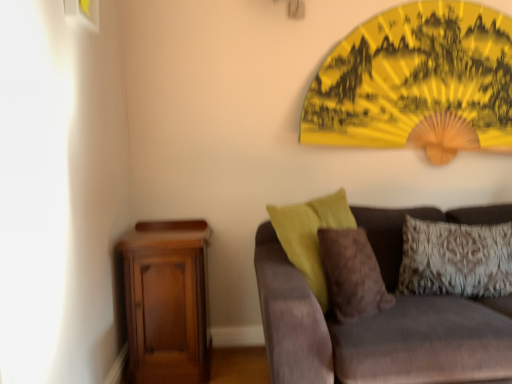
Question: Does brown fuzzy pillow at center, the 2th pillow viewed from the right, appear on the left side of patterned fabric pillow at right, positioned as the 2th pillow in left-to-right order?

Choices:
 (A) no
 (B) yes

Answer: (B)

Question: From a real-world perspective, is brown fuzzy pillow at center, the 2th pillow viewed from the right, over patterned fabric pillow at right, marked as the 1th pillow in a right-to-left arrangement?

Choices:
 (A) yes
 (B) no

Answer: (A)

Question: Is brown fuzzy pillow at center, the 2th pillow viewed from the right, smaller than patterned fabric pillow at right, marked as the 1th pillow in a right-to-left arrangement?

Choices:
 (A) no
 (B) yes

Answer: (B)

Question: Is brown fuzzy pillow at center, which appears as the 1th pillow when viewed from the left, shorter than patterned fabric pillow at right, positioned as the 2th pillow in left-to-right order?

Choices:
 (A) yes
 (B) no

Answer: (B)

Question: Is the position of brown fuzzy pillow at center, which appears as the 1th pillow when viewed from the left, more distant than that of patterned fabric pillow at right, marked as the 1th pillow in a right-to-left arrangement?

Choices:
 (A) yes
 (B) no

Answer: (B)

Question: From the image's perspective, is brown fuzzy pillow at center, the 2th pillow viewed from the right, located above patterned fabric pillow at right, marked as the 1th pillow in a right-to-left arrangement?

Choices:
 (A) yes
 (B) no

Answer: (B)

Question: Can you confirm if velvet brown couch at lower right is bigger than matte white picture frame at upper left?

Choices:
 (A) yes
 (B) no

Answer: (A)

Question: Is velvet brown couch at lower right to the left of matte white picture frame at upper left from the viewer's perspective?

Choices:
 (A) yes
 (B) no

Answer: (B)

Question: Is the depth of velvet brown couch at lower right greater than that of matte white picture frame at upper left?

Choices:
 (A) no
 (B) yes

Answer: (A)

Question: Considering the relative sizes of velvet brown couch at lower right and matte white picture frame at upper left in the image provided, is velvet brown couch at lower right shorter than matte white picture frame at upper left?

Choices:
 (A) yes
 (B) no

Answer: (B)

Question: Considering the relative positions of velvet brown couch at lower right and matte white picture frame at upper left in the image provided, is velvet brown couch at lower right to the right of matte white picture frame at upper left from the viewer's perspective?

Choices:
 (A) no
 (B) yes

Answer: (B)

Question: Is velvet brown couch at lower right aimed at matte white picture frame at upper left?

Choices:
 (A) yes
 (B) no

Answer: (B)

Question: Is matte white picture frame at upper left positioned far away from patterned fabric pillow at right, marked as the 1th pillow in a right-to-left arrangement?

Choices:
 (A) no
 (B) yes

Answer: (B)